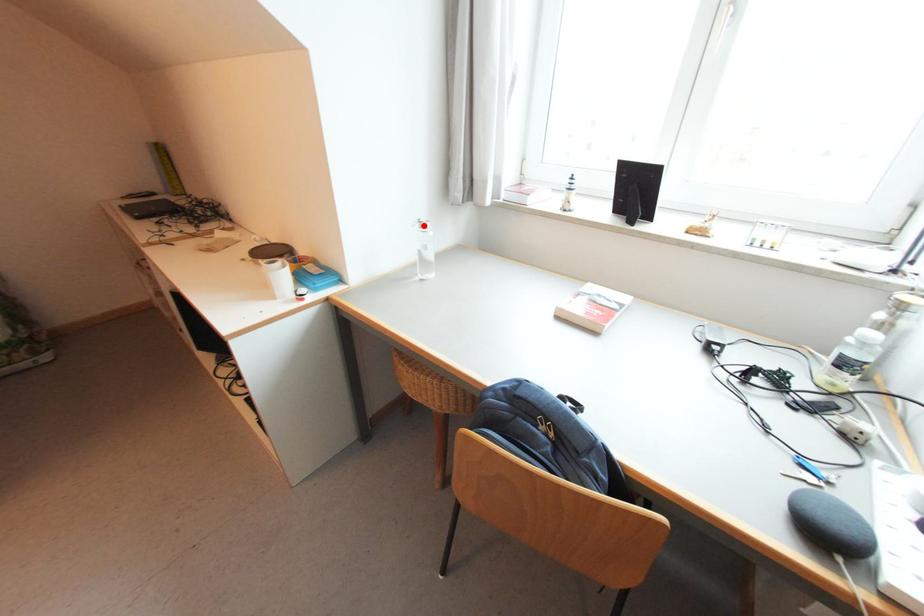
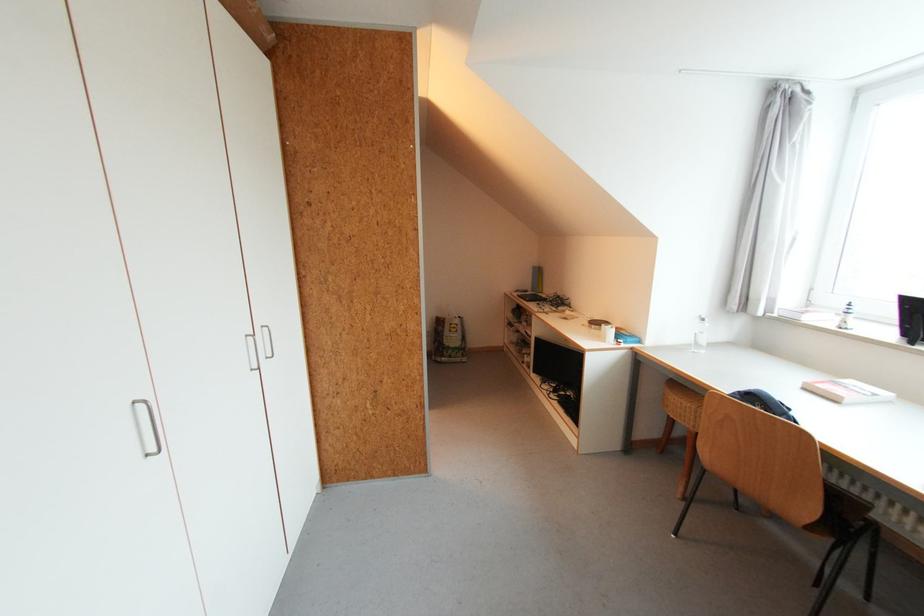
In the second image, find the point that corresponds to the highlighted location in the first image.

(703, 320)